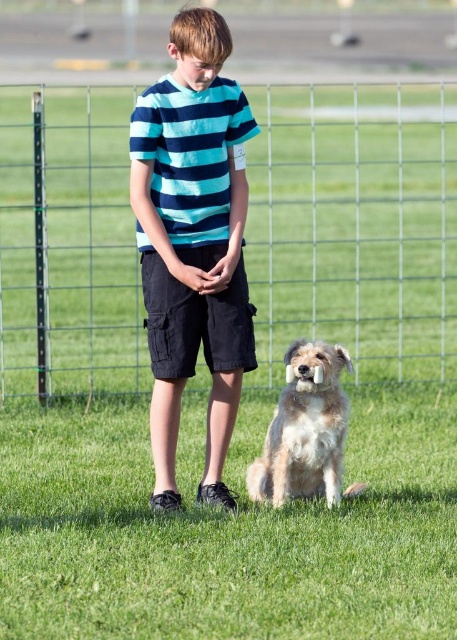
You are standing on the grassy field and want to go to the point marked by point (355, 225). What is the nearest object you need to pass through or around to reach it?

The point (355, 225) is on wire mesh fence at center, so you need to pass through or around the wire mesh fence at center to reach it.